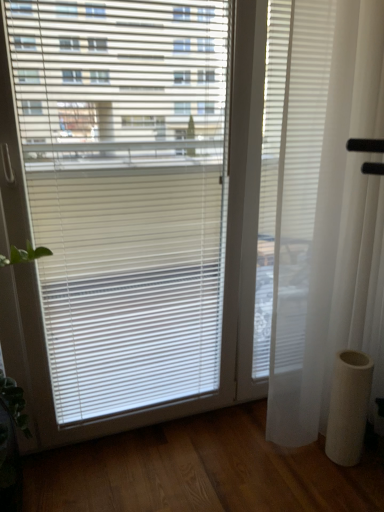
Question: From the image's perspective, is white sheer curtain at right located above or below white matte cylinder at lower right?

Choices:
 (A) below
 (B) above

Answer: (B)

Question: Relative to white matte cylinder at lower right, is white sheer curtain at right in front or behind?

Choices:
 (A) behind
 (B) front

Answer: (B)

Question: Considering the relative positions of white sheer curtain at right and white matte cylinder at lower right in the image provided, is white sheer curtain at right to the left or to the right of white matte cylinder at lower right?

Choices:
 (A) left
 (B) right

Answer: (A)

Question: In terms of size, does white matte cylinder at lower right appear bigger or smaller than white sheer curtain at right?

Choices:
 (A) small
 (B) big

Answer: (A)

Question: Is point (342, 374) positioned closer to the camera than point (370, 132)?

Choices:
 (A) farther
 (B) closer

Answer: (A)

Question: Is white matte cylinder at lower right wider or thinner than white sheer curtain at right?

Choices:
 (A) thin
 (B) wide

Answer: (A)

Question: Is white matte cylinder at lower right taller or shorter than white sheer curtain at right?

Choices:
 (A) tall
 (B) short

Answer: (B)